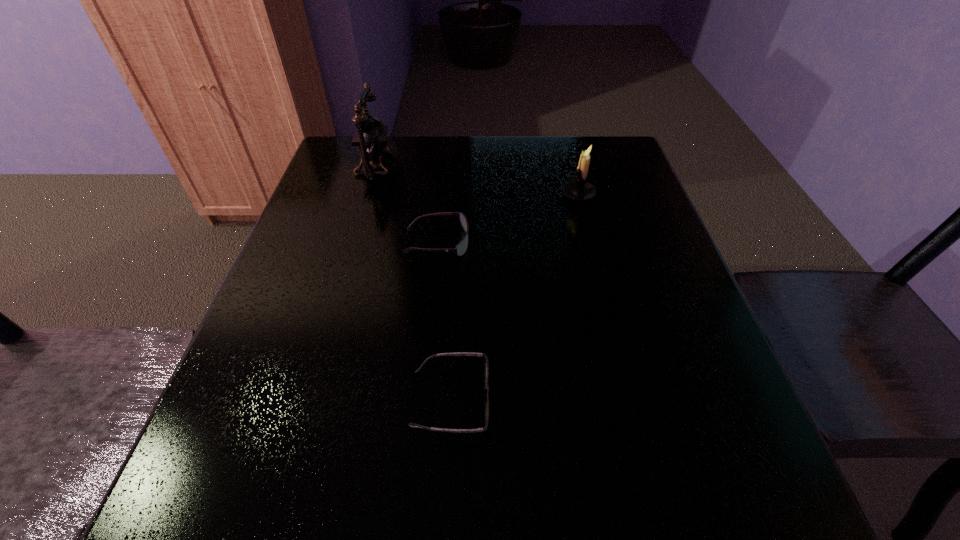
Locate an element on the screen. The width and height of the screenshot is (960, 540). the farthest object is located at coordinates point(370,139).

What are the coordinates of `the tallest object` in the screenshot? It's located at (370, 139).

Locate an element on the screen. This screenshot has width=960, height=540. the third shortest object is located at coordinates (579, 189).

Where is `the third nearest object`? The height and width of the screenshot is (540, 960). the third nearest object is located at coordinates (579, 189).

Image resolution: width=960 pixels, height=540 pixels. I want to click on the second nearest object, so click(x=461, y=248).

Where is `the second shortest object`? the second shortest object is located at coordinates (461, 248).

This screenshot has width=960, height=540. I want to click on the shortest object, so click(x=486, y=400).

Locate an element on the screen. the nearer sunglasses is located at coordinates (486, 400).

The height and width of the screenshot is (540, 960). What are the coordinates of `vacant space situated 0.390m on the rotary dial of the tallest object` in the screenshot? It's located at (545, 165).

This screenshot has width=960, height=540. What are the coordinates of `free region located on the back of the second tallest object` in the screenshot? It's located at (565, 142).